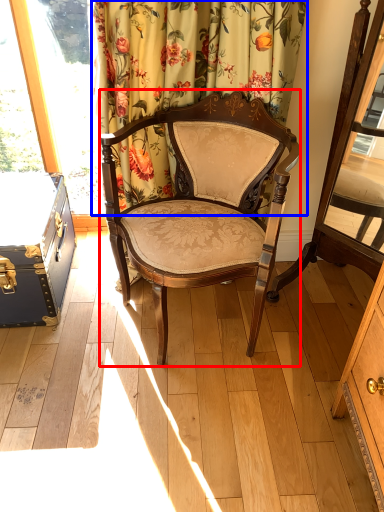
Question: Which point is further to the camera, chair (highlighted by a red box) or curtain (highlighted by a blue box)?

Choices:
 (A) chair
 (B) curtain

Answer: (B)